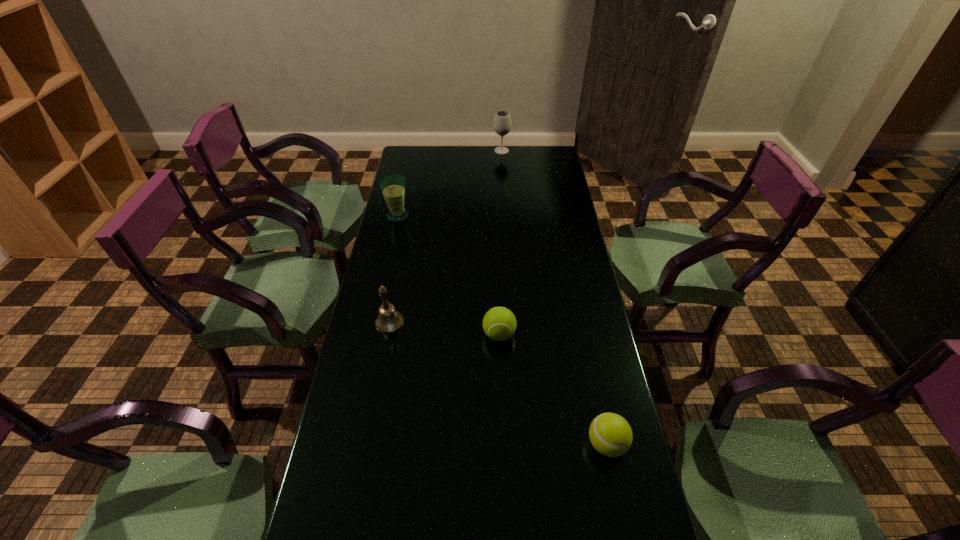
Find the location of a particular element. Image resolution: width=960 pixels, height=540 pixels. the farthest object is located at coordinates pyautogui.click(x=502, y=124).

This screenshot has width=960, height=540. Identify the location of glass. (392, 185).

Locate an element on the screen. This screenshot has width=960, height=540. bell is located at coordinates (389, 320).

This screenshot has height=540, width=960. In order to click on the nearer tennis ball in this screenshot , I will do `click(610, 434)`.

Image resolution: width=960 pixels, height=540 pixels. I want to click on the nearest object, so click(610, 434).

The image size is (960, 540). I want to click on the left tennis ball, so click(x=499, y=323).

Locate an element on the screen. vacant space situated 0.240m on the left of the wineglass is located at coordinates (444, 151).

Locate an element on the screen. vacant space located 0.150m on the front of the fourth nearest object is located at coordinates (391, 248).

At what (x,y) coordinates should I click in order to perform the action: click on vacant space located on the back of the bell. Please return your answer as a coordinate pair (x, y). The image size is (960, 540). Looking at the image, I should click on (406, 234).

The width and height of the screenshot is (960, 540). What are the coordinates of `free space located 0.060m on the left of the rightmost object` in the screenshot? It's located at (563, 444).